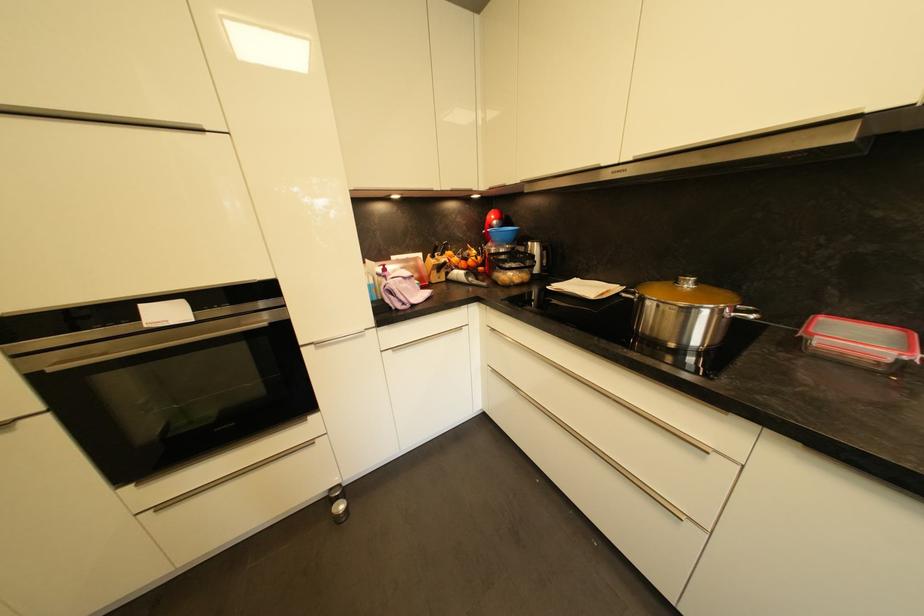
Describe the element at coordinates (745, 312) in the screenshot. The height and width of the screenshot is (616, 924). I see `the pot side handle` at that location.